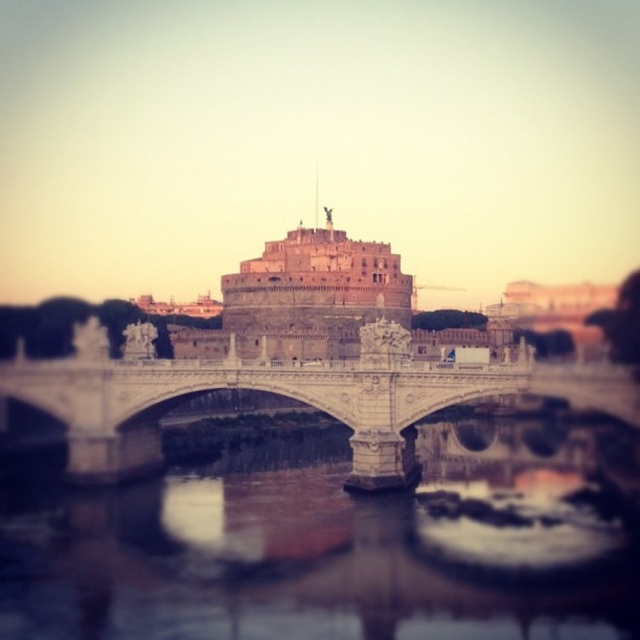
Which is behind, point (227, 525) or point (145, 340)?

The point (145, 340) is more distant.

Measure the distance between brown reflective water at center and white stone bridge at center.

They are 9.37 meters apart.

Where is `brown reflective water at center`? The height and width of the screenshot is (640, 640). brown reflective water at center is located at coordinates (339, 541).

The width and height of the screenshot is (640, 640). I want to click on brown reflective water at center, so (339, 541).